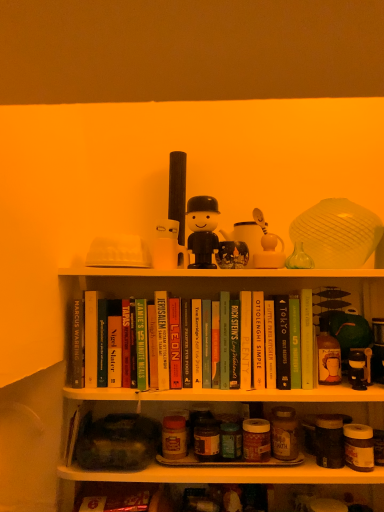
Question: Relative to hardcover book at center, positioned as the first paperback book in left-to-right order, is hardcover book at center, the seventh paperback book in the right-to-left sequence, in front or behind?

Choices:
 (A) front
 (B) behind

Answer: (A)

Question: In the image, is hardcover book at center, which is the eighth paperback book in left-to-right order, on the left side or the right side of hardcover book at center, which appears as the 14th paperback book when viewed from the right?

Choices:
 (A) left
 (B) right

Answer: (B)

Question: Which is nearer to the hardcover book at center, which is the eleventh paperback book in right-to-left order?

Choices:
 (A) black matte figure at center, which is the 3th toy from right to left
 (B) smooth plastic toy at center, the 1th toy when ordered from left to right
 (C) hardcover book at center, which is the 7th paperback book from left to right
 (D) hardcover book at center, which is counted as the 10th paperback book, starting from the left
 (E) green matte book at center, which is the 1th paperback book from right to left

Answer: (C)

Question: Estimate the real-world distances between objects in this image. Which object is farther from the matte glass jars at lower center?

Choices:
 (A) hardcover book at center, positioned as the first paperback book in left-to-right order
 (B) hardcover book at center, which is the 7th paperback book from left to right
 (C) hardcover book at center, which is the twelfth paperback book from right to left
 (D) black matte figure at center, acting as the second toy starting from the left
 (E) hardcover book at center, the seventh paperback book in the right-to-left sequence

Answer: (D)